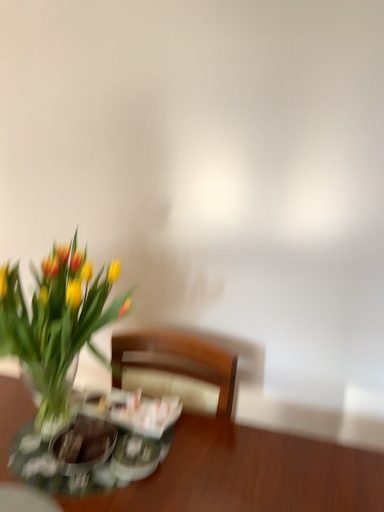
Identify the location of translucent glass vase at left. (56, 323).

The image size is (384, 512). What do you see at coordinates (56, 323) in the screenshot?
I see `translucent glass vase at left` at bounding box center [56, 323].

Image resolution: width=384 pixels, height=512 pixels. Find the location of `wooden table at lower left`. wooden table at lower left is located at coordinates (249, 474).

The height and width of the screenshot is (512, 384). What do you see at coordinates (249, 474) in the screenshot?
I see `wooden table at lower left` at bounding box center [249, 474].

This screenshot has width=384, height=512. I want to click on translucent glass vase at left, so click(56, 323).

Which object is positioned more to the right, wooden table at lower left or translucent glass vase at left?

Positioned to the right is wooden table at lower left.

Is wooden table at lower left further to the viewer compared to translucent glass vase at left?

Yes, it is behind translucent glass vase at left.

Does point (256, 450) lie behind point (38, 389)?

No, (256, 450) is closer to viewer.

From the image's perspective, who appears lower, wooden table at lower left or translucent glass vase at left?

From the image's view, wooden table at lower left is below.

From a real-world perspective, is wooden table at lower left above or below translucent glass vase at left?

wooden table at lower left is situated lower than translucent glass vase at left in the real world.

Considering the relative sizes of wooden table at lower left and translucent glass vase at left in the image provided, is wooden table at lower left thinner than translucent glass vase at left?

No, wooden table at lower left is not thinner than translucent glass vase at left.

Does wooden table at lower left have a lesser height compared to translucent glass vase at left?

Incorrect, the height of wooden table at lower left does not fall short of that of translucent glass vase at left.

Does wooden table at lower left have a smaller size compared to translucent glass vase at left?

Incorrect, wooden table at lower left is not smaller in size than translucent glass vase at left.

Would you say translucent glass vase at left is part of wooden table at lower left's contents?

That's incorrect, translucent glass vase at left is not inside wooden table at lower left.

Is wooden table at lower left far away from translucent glass vase at left?

No, wooden table at lower left is not far from translucent glass vase at left.

Is wooden table at lower left aimed at translucent glass vase at left?

No.

Looking at this image, how different are the orientations of wooden table at lower left and translucent glass vase at left in degrees?

wooden table at lower left and translucent glass vase at left are facing 3.72e-05 degrees away from each other.

Measure the distance from wooden table at lower left to translucent glass vase at left.

wooden table at lower left and translucent glass vase at left are 13.71 inches apart.

Locate an element on the screen. This screenshot has height=512, width=384. table below the translucent glass vase at left (from the image's perspective) is located at coordinates [x=249, y=474].

Is translucent glass vase at left at the right side of wooden table at lower left?

No, translucent glass vase at left is not to the right of wooden table at lower left.

Is translucent glass vase at left further to camera compared to wooden table at lower left?

No, translucent glass vase at left is in front of wooden table at lower left.

Does point (54, 282) come farther from viewer compared to point (12, 383)?

No.

From the image's perspective, is translucent glass vase at left beneath wooden table at lower left?

No.

From a real-world perspective, which is physically above, translucent glass vase at left or wooden table at lower left?

In real-world perspective, translucent glass vase at left is above.

Consider the image. Does translucent glass vase at left have a lesser width compared to wooden table at lower left?

Yes.

Considering the relative sizes of translucent glass vase at left and wooden table at lower left in the image provided, is translucent glass vase at left taller than wooden table at lower left?

In fact, translucent glass vase at left may be shorter than wooden table at lower left.

Considering the relative sizes of translucent glass vase at left and wooden table at lower left in the image provided, is translucent glass vase at left bigger than wooden table at lower left?

No.

Is translucent glass vase at left not within wooden table at lower left?

translucent glass vase at left lies outside wooden table at lower left's area.

Is translucent glass vase at left in contact with wooden table at lower left?

translucent glass vase at left is not next to wooden table at lower left, and they're not touching.

Is translucent glass vase at left positioned with its back to wooden table at lower left?

No, wooden table at lower left is not at the back of translucent glass vase at left.

What's the angular difference between translucent glass vase at left and wooden table at lower left's facing directions?

3.72e-05 degrees.

How distant is translucent glass vase at left from wooden table at lower left?

translucent glass vase at left and wooden table at lower left are 13.71 inches apart.

The height and width of the screenshot is (512, 384). I want to click on table behind the translucent glass vase at left, so click(x=249, y=474).

At what (x,y) coordinates should I click in order to perform the action: click on flower above the wooden table at lower left (from a real-world perspective). Please return your answer as a coordinate pair (x, y). Image resolution: width=384 pixels, height=512 pixels. Looking at the image, I should click on (56, 323).

The image size is (384, 512). I want to click on flower lying above the wooden table at lower left (from the image's perspective), so coord(56,323).